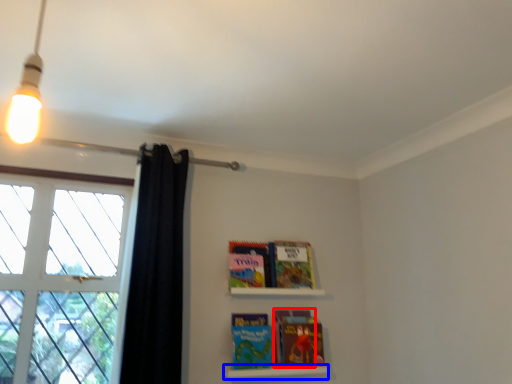
Question: Which object appears farthest to the camera in this image, paperback book (highlighted by a red box) or shelf (highlighted by a blue box)?

Choices:
 (A) paperback book
 (B) shelf

Answer: (A)